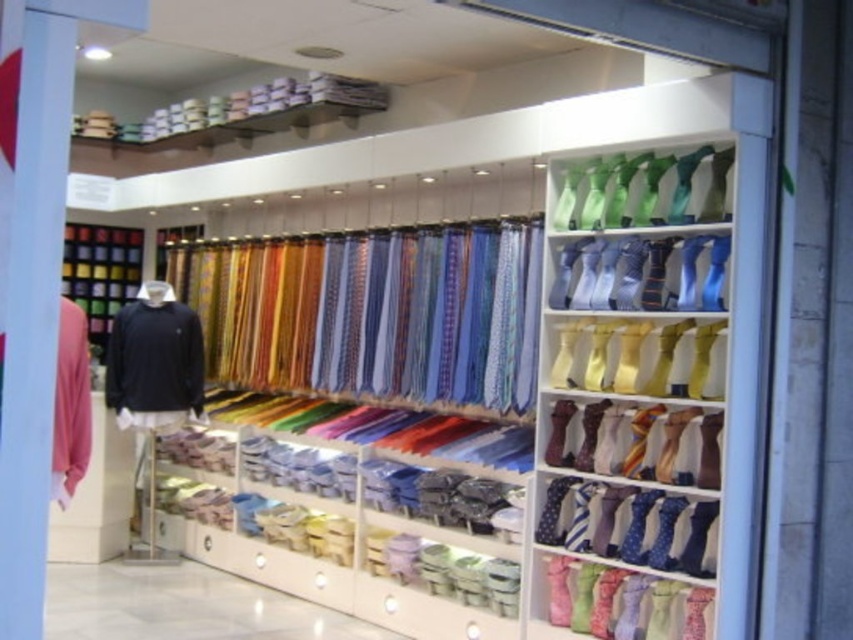
What is located at the coordinates point (631,385) in the image?

The coordinates point (631,385) indicate the location of shiny silk ties at upper right.

What are the coordinates of the shiny silk ties at center?

The shiny silk ties at center are located at coordinates point (374, 312).

You are a customer browsing the retail display. You want to pick up the shiny silk ties at center and the black matte sweater at left. Which item will you need to reach higher to get?

The shiny silk ties at center are located above the black matte sweater at left, so you will need to reach higher to get the shiny silk ties at center.